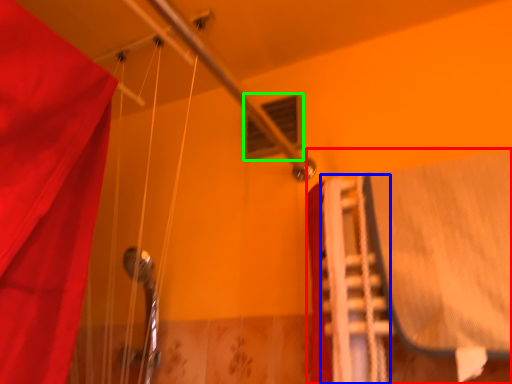
Question: Based on their relative distances, which object is farther from bed (highlighted by a red box)? Choose from stair (highlighted by a blue box) and window (highlighted by a green box).

Choices:
 (A) stair
 (B) window

Answer: (B)